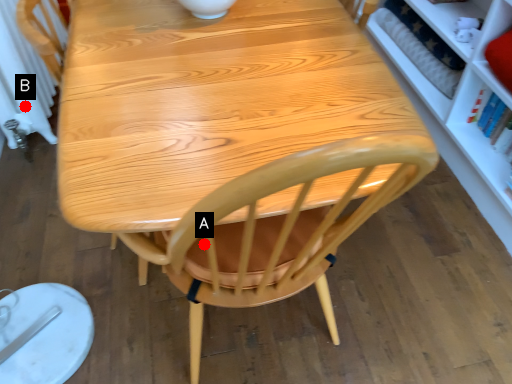
Question: Two points are circled on the image, labeled by A and B beside each circle. Which point appears farthest from the camera in this image?

Choices:
 (A) A is further
 (B) B is further

Answer: (B)